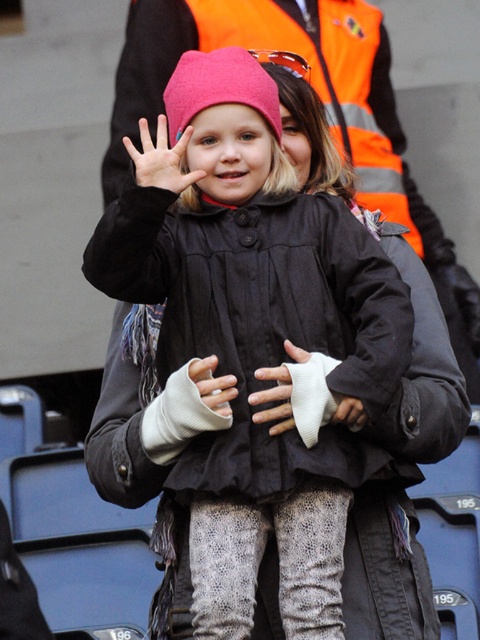
Does matte black jacket at center have a lesser width compared to white woolen glove at center?

No, matte black jacket at center is not thinner than white woolen glove at center.

Between matte black jacket at center and white woolen glove at center, which one is positioned lower?

white woolen glove at center

Between point (227, 90) and point (222, 394), which one is positioned in front?

Positioned in front is point (222, 394).

At what (x,y) coordinates should I click in order to perform the action: click on matte black jacket at center. Please return your answer as a coordinate pair (x, y). Looking at the image, I should click on (256, 340).

Who is lower down, pink fabric hat at center or white woolen glove at center?

Positioned lower is white woolen glove at center.

Where is `pink fabric hat at center`? The width and height of the screenshot is (480, 640). pink fabric hat at center is located at coordinates (218, 88).

Measure the distance between point (180, 131) and camera.

Point (180, 131) and camera are 166.80 feet apart from each other.

Identify the location of pink fabric hat at center. (218, 88).

Does point (222, 67) come behind point (280, 390)?

Yes.

Looking at this image, does pink fabric hat at center have a larger size compared to white cotton glove at center?

Indeed, pink fabric hat at center has a larger size compared to white cotton glove at center.

I want to click on pink fabric hat at center, so click(218, 88).